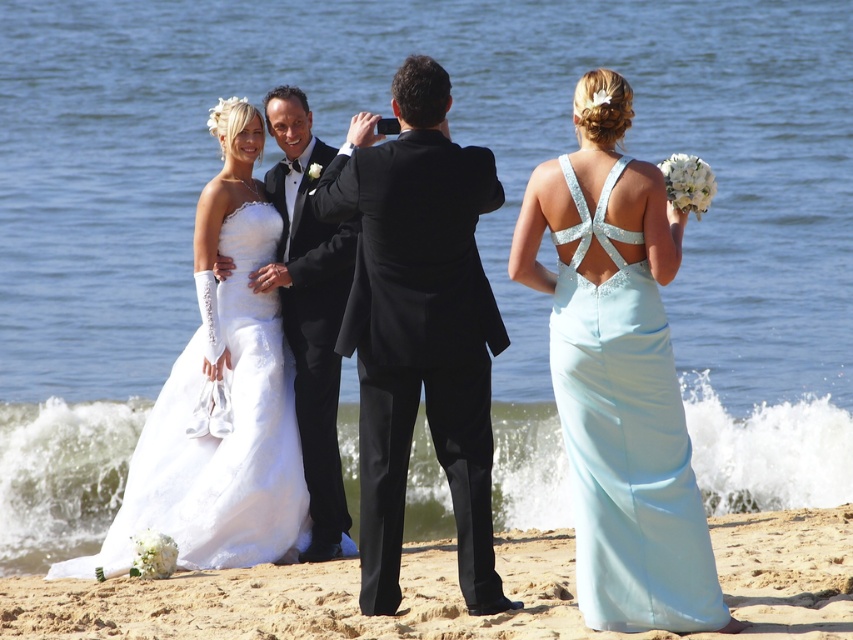
You are a photographer at the beach wedding scene. You want to focus on the two points in the image, point (236, 301) and point (315, 545). Which point is closer to your camera?

Point (236, 301) is further to the camera than point (315, 545), so the point closer to the camera is point (236, 301).

In the scene shown: You are a photographer at the wedding scene. You need to adjust your camera focus to the matte white gown at center. According to the coordinates provided, where exactly should you aim your camera?

The matte white gown at center is located at point (231, 401), so you should aim your camera at those coordinates to focus on it.

Based on the coordinates provided, which object is located at point (619, 374) in the wedding scene?

The light blue satin dress at right is located at point (619, 374).